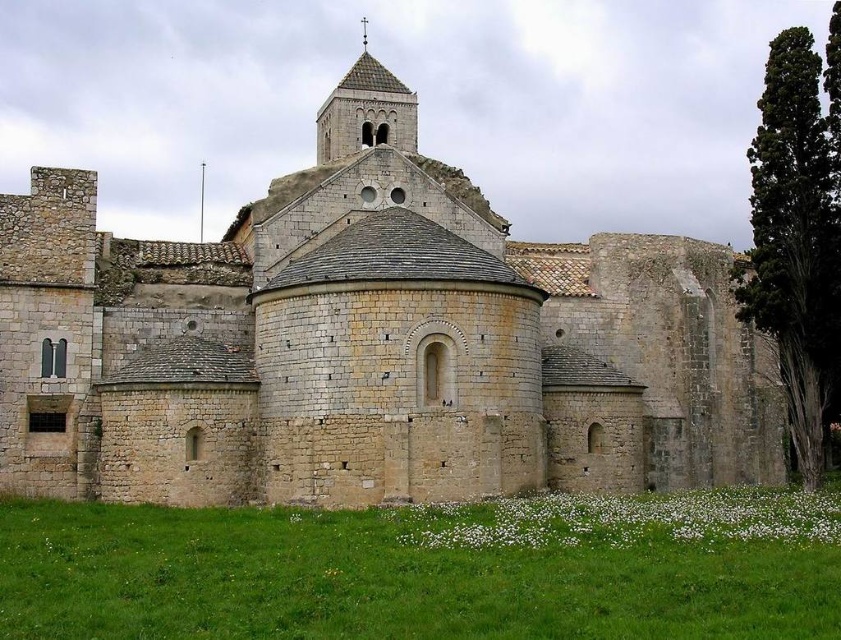
Question: Which point is farther to the camera?

Choices:
 (A) (669, 477)
 (B) (339, 152)

Answer: (B)

Question: Can you confirm if stone castle at center is positioned to the left of smooth stone tower at upper center?

Choices:
 (A) yes
 (B) no

Answer: (B)

Question: Is stone castle at center positioned behind smooth stone tower at upper center?

Choices:
 (A) yes
 (B) no

Answer: (B)

Question: In this image, where is stone castle at center located relative to smooth stone tower at upper center?

Choices:
 (A) below
 (B) above

Answer: (A)

Question: Among these objects, which one is nearest to the camera?

Choices:
 (A) smooth stone tower at upper center
 (B) stone castle at center

Answer: (B)

Question: Which of the following is the farthest from the observer?

Choices:
 (A) smooth stone tower at upper center
 (B) stone castle at center

Answer: (A)